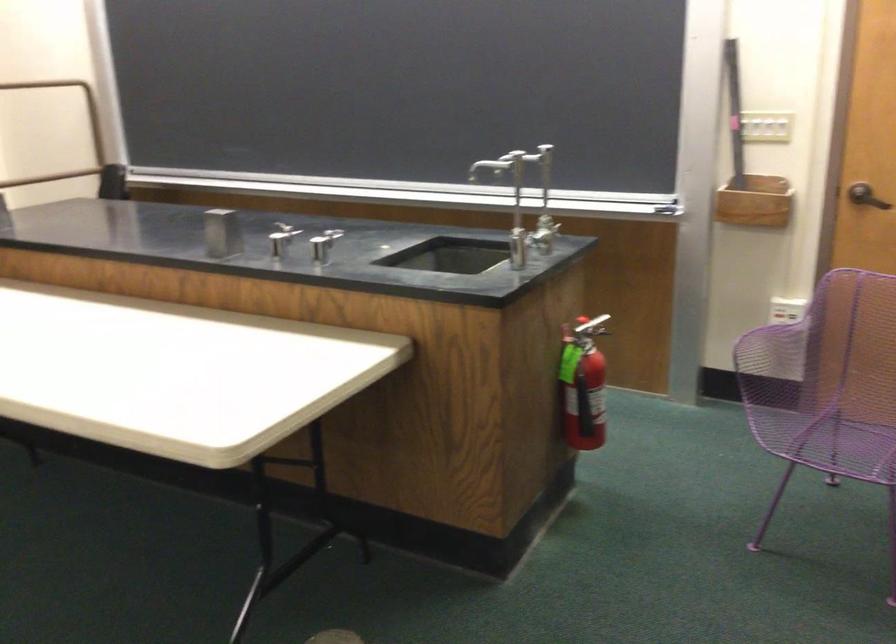
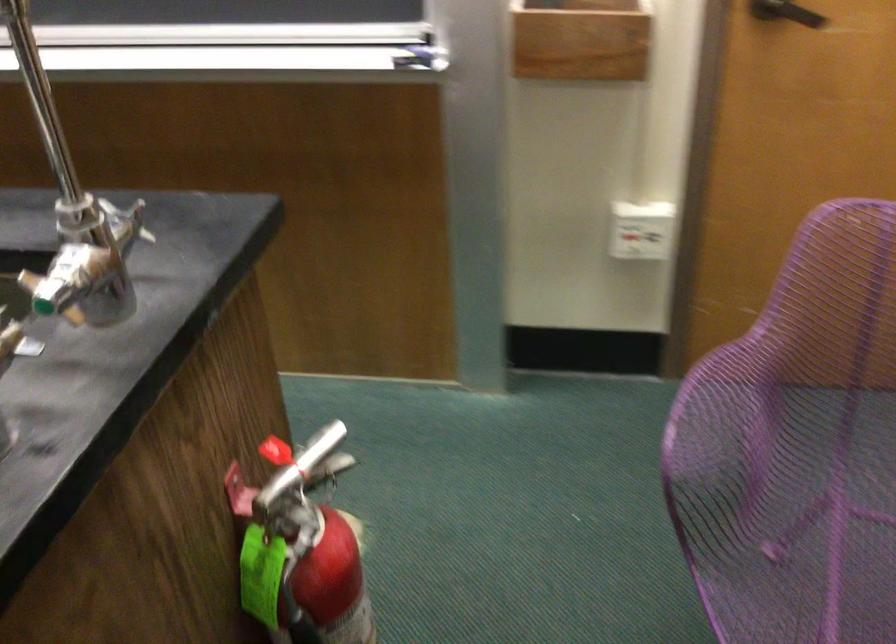
Question: What movement of the cameraman would produce the second image?

Choices:
 (A) Left
 (B) Right
 (C) Forward
 (D) Backward

Answer: (C)